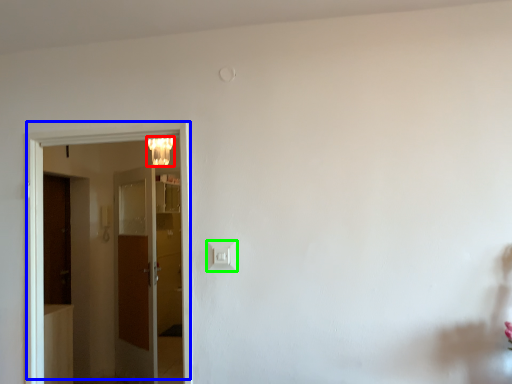
Question: Considering the real-world distances, which object is farthest from lamp (highlighted by a red box)? door (highlighted by a blue box) or light switch (highlighted by a green box)?

Choices:
 (A) door
 (B) light switch

Answer: (B)